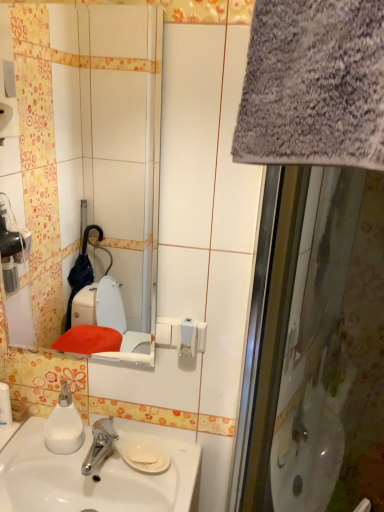
Question: From the image's perspective, is white glossy sink at lower left positioned above or below gray fabric screen door at right?

Choices:
 (A) above
 (B) below

Answer: (B)

Question: Considering the positions of white glossy sink at lower left and gray fabric screen door at right in the image, is white glossy sink at lower left bigger or smaller than gray fabric screen door at right?

Choices:
 (A) small
 (B) big

Answer: (A)

Question: Which object is positioned farthest from the white matte soap dispenser at lower left?

Choices:
 (A) white glossy sink at lower left
 (B) white glossy soap dispenser at lower left
 (C) gray fabric screen door at right
 (D) white glossy mirror at upper center

Answer: (D)

Question: Which of these objects is positioned farthest from the white glossy mirror at upper center?

Choices:
 (A) white matte soap dispenser at lower left
 (B) gray fabric screen door at right
 (C) white glossy soap dispenser at lower left
 (D) white glossy sink at lower left

Answer: (B)